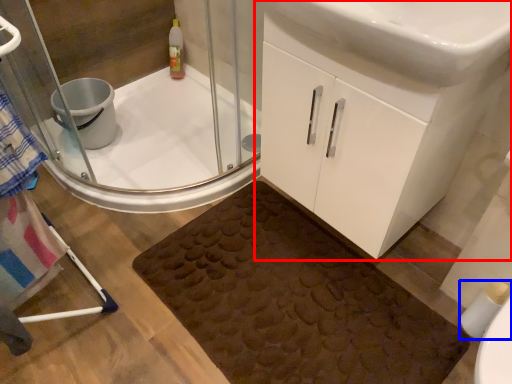
Question: Which point is further to the camera, bathroom cabinet (highlighted by a red box) or toilet paper (highlighted by a blue box)?

Choices:
 (A) bathroom cabinet
 (B) toilet paper

Answer: (B)